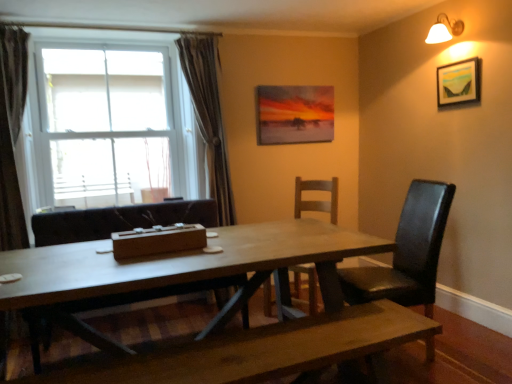
What do you see at coordinates (295, 114) in the screenshot? The height and width of the screenshot is (384, 512). I see `matte canvas painting at upper center, acting as the 2th picture frame starting from the right` at bounding box center [295, 114].

This screenshot has width=512, height=384. Describe the element at coordinates (12, 134) in the screenshot. I see `brown fabric curtain at left, which ranks as the 1th curtain in left-to-right order` at that location.

This screenshot has height=384, width=512. Find the location of `matte canvas painting at upper center, acting as the 2th picture frame starting from the right`. matte canvas painting at upper center, acting as the 2th picture frame starting from the right is located at coordinates point(295,114).

Is wooden chair at center, which is the 3th chair from right to left, bigger or smaller than white ceramic wall lamp at upper right?

wooden chair at center, which is the 3th chair from right to left, is bigger than white ceramic wall lamp at upper right.

Does wooden chair at center, which is the 3th chair from right to left, have a lesser width compared to white ceramic wall lamp at upper right?

No.

Is wooden chair at center, which is the 3th chair from right to left, inside the boundaries of white ceramic wall lamp at upper right, or outside?

wooden chair at center, which is the 3th chair from right to left, is located beyond the bounds of white ceramic wall lamp at upper right.

From the image's perspective, relative to white ceramic wall lamp at upper right, is wooden chair at center, which is the 3th chair from right to left, above or below?

From the image's perspective, wooden chair at center, which is the 3th chair from right to left, appears below white ceramic wall lamp at upper right.

Is white glass window at upper left spatially inside wooden table at center, or outside of it?

white glass window at upper left is outside wooden table at center.

From the image's perspective, is white glass window at upper left below wooden table at center?

Actually, white glass window at upper left appears above wooden table at center in the image.

Is white glass window at upper left directly adjacent to wooden table at center?

No, white glass window at upper left is not in contact with wooden table at center.

Between point (56, 81) and point (81, 254), which one is positioned in front?

The point (81, 254) is in front.

Looking at this image, is black leather chair at right, placed as the 1th chair when sorted from right to left, beside white ceramic wall lamp at upper right?

There is a gap between black leather chair at right, placed as the 1th chair when sorted from right to left, and white ceramic wall lamp at upper right.

Who is smaller, black leather chair at right, arranged as the 3th chair when viewed from the left, or white ceramic wall lamp at upper right?

white ceramic wall lamp at upper right.

Which object is positioned more to the right, black leather chair at right, placed as the 1th chair when sorted from right to left, or white ceramic wall lamp at upper right?

From the viewer's perspective, white ceramic wall lamp at upper right appears more on the right side.

Is black leather chair at right, placed as the 1th chair when sorted from right to left, looking in the opposite direction of white ceramic wall lamp at upper right?

No.

How many degrees apart are the facing directions of wooden chair at center, which is the first chair from left to right, and brown fabric curtain at left, which ranks as the 1th curtain in left-to-right order?

The angular difference between wooden chair at center, which is the first chair from left to right, and brown fabric curtain at left, which ranks as the 1th curtain in left-to-right order, is 6.13 degrees.

From the image's perspective, is wooden chair at center, which is the first chair from left to right, below brown fabric curtain at left, positioned as the first curtain in front-to-back order?

Yes, from the image's perspective, wooden chair at center, which is the first chair from left to right, is beneath brown fabric curtain at left, positioned as the first curtain in front-to-back order.

Can you confirm if wooden chair at center, which is the 3th chair from right to left, is wider than brown fabric curtain at left, arranged as the second curtain when viewed from the right?

Yes, wooden chair at center, which is the 3th chair from right to left, is wider than brown fabric curtain at left, arranged as the second curtain when viewed from the right.

Is wooden chair at center, which is the first chair from left to right, positioned with its back to brown fabric curtain at left, which ranks as the 1th curtain in left-to-right order?

wooden chair at center, which is the first chair from left to right, does not have its back to brown fabric curtain at left, which ranks as the 1th curtain in left-to-right order.

Is wooden picture frame at upper right, placed as the second picture frame when sorted from left to right, bigger than wooden chair at center, which is the 2th chair in right-to-left order?

Incorrect, wooden picture frame at upper right, placed as the second picture frame when sorted from left to right, is not larger than wooden chair at center, which is the 2th chair in right-to-left order.

Looking at this image, is wooden picture frame at upper right, which is the 1th picture frame from right to left, far from wooden chair at center, the second chair positioned from the left?

That's right, there is a large distance between wooden picture frame at upper right, which is the 1th picture frame from right to left, and wooden chair at center, the second chair positioned from the left.

Is wooden picture frame at upper right, placed as the second picture frame when sorted from left to right, turned away from wooden chair at center, which is the 2th chair in right-to-left order?

That's not correct — wooden picture frame at upper right, placed as the second picture frame when sorted from left to right, is not looking away from wooden chair at center, which is the 2th chair in right-to-left order.

Is wooden picture frame at upper right, which ranks as the first picture frame in front-to-back order, located outside wooden chair at center, which is the 2th chair in right-to-left order?

Yes, wooden picture frame at upper right, which ranks as the first picture frame in front-to-back order, is not within wooden chair at center, which is the 2th chair in right-to-left order.

From the image's perspective, is wooden table at center on top of black leather chair at right, arranged as the 3th chair when viewed from the left?

No, from the image's perspective, wooden table at center is not above black leather chair at right, arranged as the 3th chair when viewed from the left.

Where is `kitchen & dining room table in front of the black leather chair at right, placed as the 1th chair when sorted from right to left`? This screenshot has height=384, width=512. kitchen & dining room table in front of the black leather chair at right, placed as the 1th chair when sorted from right to left is located at coordinates (187, 265).

Is wooden table at center facing away from black leather chair at right, arranged as the 3th chair when viewed from the left?

No, wooden table at center's orientation is not away from black leather chair at right, arranged as the 3th chair when viewed from the left.

Is wooden chair at center, the second chair positioned from the left, wider than matte canvas painting at upper center, placed as the second picture frame when sorted from front to back?

Correct, the width of wooden chair at center, the second chair positioned from the left, exceeds that of matte canvas painting at upper center, placed as the second picture frame when sorted from front to back.

From the image's perspective, which one is positioned lower, wooden chair at center, the second chair positioned from the left, or matte canvas painting at upper center, which appears as the 1th picture frame when viewed from the left?

wooden chair at center, the second chair positioned from the left, from the image's perspective.

Can you confirm if wooden chair at center, which is the 2th chair in right-to-left order, is bigger than matte canvas painting at upper center, placed as the second picture frame when sorted from front to back?

Indeed, wooden chair at center, which is the 2th chair in right-to-left order, has a larger size compared to matte canvas painting at upper center, placed as the second picture frame when sorted from front to back.

This screenshot has height=384, width=512. I want to click on the 3rd chair below the white ceramic wall lamp at upper right (from the image's perspective), so click(x=118, y=220).

Locate an element on the screen. window behind the wooden table at center is located at coordinates (111, 123).

When comparing their distances from satin gray curtain at left, which is the first curtain in right-to-left order, does wooden table at center or wooden chair at center, which is the 2th chair in right-to-left order, seem further?

wooden table at center lies further to satin gray curtain at left, which is the first curtain in right-to-left order, than the other object.

Looking at the image, which one is located closer to wooden table at center, matte canvas painting at upper center, placed as the second picture frame when sorted from front to back, or satin gray curtain at left, the 1th curtain in the back-to-front sequence?

The object closer to wooden table at center is satin gray curtain at left, the 1th curtain in the back-to-front sequence.

In the scene shown: Based on their spatial positions, is satin gray curtain at left, which is the second curtain from left to right, or white glass window at upper left further from white ceramic wall lamp at upper right?

white glass window at upper left is further to white ceramic wall lamp at upper right.

Looking at this image, looking at the image, which one is located closer to wooden picture frame at upper right, placed as the second picture frame when sorted from left to right, wooden chair at center, which is the 3th chair from right to left, or white glass window at upper left?

wooden chair at center, which is the 3th chair from right to left, lies closer to wooden picture frame at upper right, placed as the second picture frame when sorted from left to right, than the other object.

Considering their positions, is black leather chair at right, arranged as the 3th chair when viewed from the left, positioned further to brown fabric curtain at left, positioned as the first curtain in front-to-back order, than wooden table at center?

Among the two, black leather chair at right, arranged as the 3th chair when viewed from the left, is located further to brown fabric curtain at left, positioned as the first curtain in front-to-back order.

Considering their positions, is matte canvas painting at upper center, acting as the 2th picture frame starting from the right, positioned further to wooden chair at center, which is the first chair from left to right, than wooden table at center?

Among the two, matte canvas painting at upper center, acting as the 2th picture frame starting from the right, is located further to wooden chair at center, which is the first chair from left to right.

Considering their positions, is white ceramic wall lamp at upper right positioned further to brown fabric curtain at left, arranged as the second curtain when viewed from the right, than black leather chair at right, arranged as the 3th chair when viewed from the left?

white ceramic wall lamp at upper right lies further to brown fabric curtain at left, arranged as the second curtain when viewed from the right, than the other object.

Looking at the image, which one is located closer to wooden picture frame at upper right, which ranks as the first picture frame in front-to-back order, wooden chair at center, the second chair positioned from the left, or brown fabric curtain at left, arranged as the second curtain when viewed from the right?

Among the two, wooden chair at center, the second chair positioned from the left, is located nearer to wooden picture frame at upper right, which ranks as the first picture frame in front-to-back order.

You are a GUI agent. You are given a task and a screenshot of the screen. Output one action in this format:
    pyautogui.click(x=<x>, y=<y>)
    Task: Click on the picture frame between white glass window at upper left and white ceramic wall lamp at upper right in the horizontal direction
    The image size is (512, 384).
    Given the screenshot: What is the action you would take?
    pyautogui.click(x=295, y=114)

Identify the location of picture frame between wooden picture frame at upper right, which is the 1th picture frame from right to left, and wooden chair at center, the second chair positioned from the left, in the vertical direction. The height and width of the screenshot is (384, 512). (295, 114).

This screenshot has height=384, width=512. Find the location of `lamp between wooden chair at center, which is the 3th chair from right to left, and wooden picture frame at upper right, placed as the second picture frame when sorted from left to right`. lamp between wooden chair at center, which is the 3th chair from right to left, and wooden picture frame at upper right, placed as the second picture frame when sorted from left to right is located at coordinates (444, 30).

Identify the location of curtain between white glass window at upper left and wooden chair at center, which is the 2th chair in right-to-left order, in the horizontal direction. (208, 116).